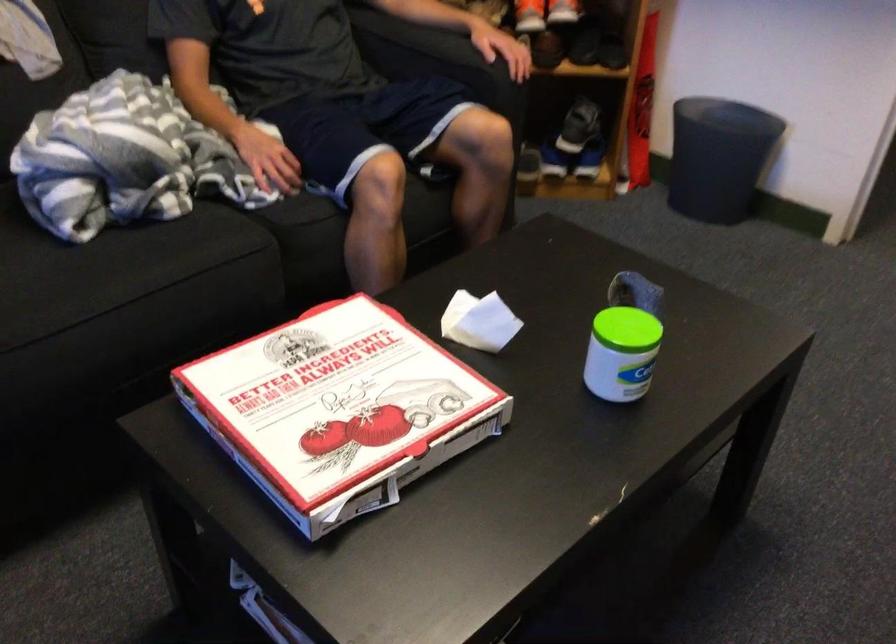
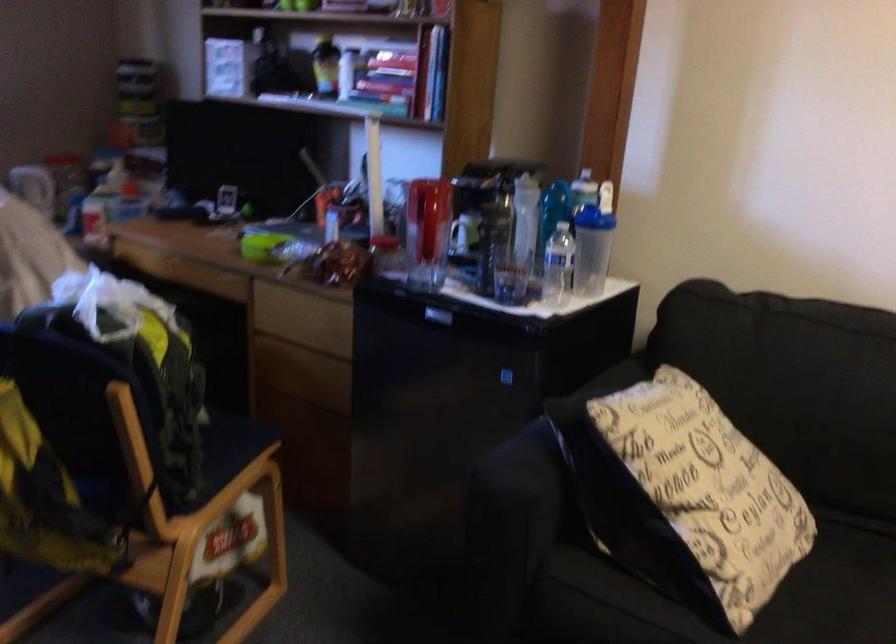
Question: The first image is from the beginning of the video and the second image is from the end. How did the camera likely rotate when shooting the video?

Choices:
 (A) Left
 (B) Right
 (C) Up
 (D) Down

Answer: (A)